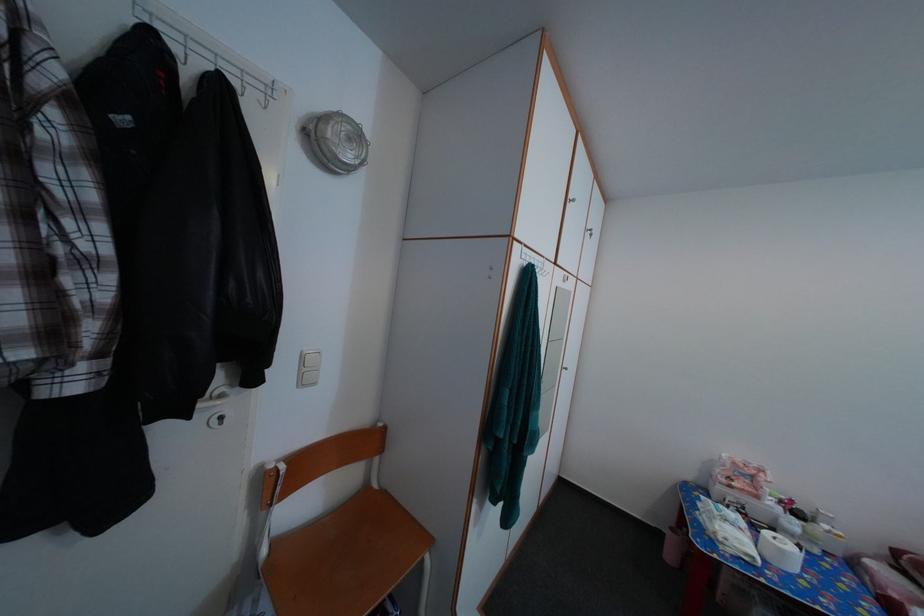
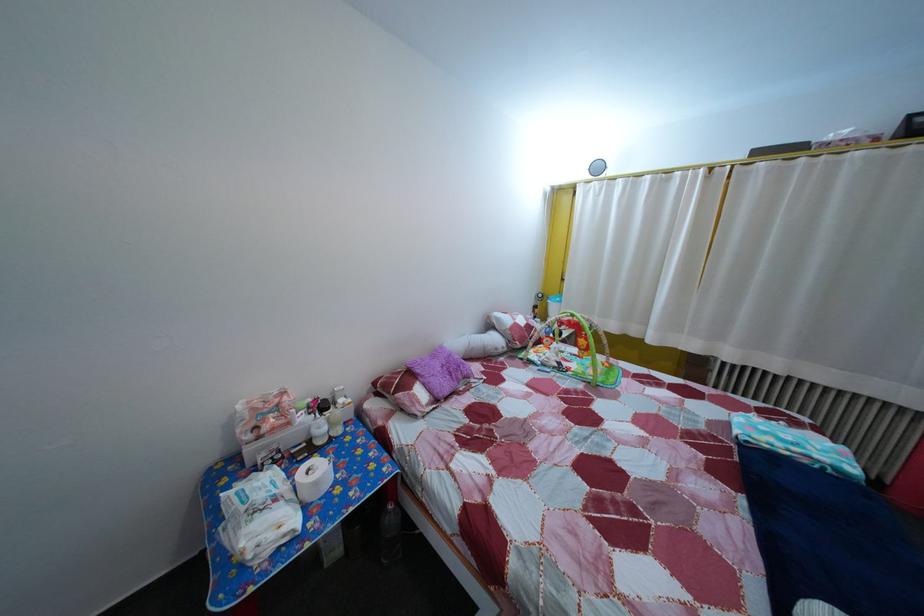
Locate, in the second image, the point that corresponds to the point at 768,505 in the first image.

(298, 432)